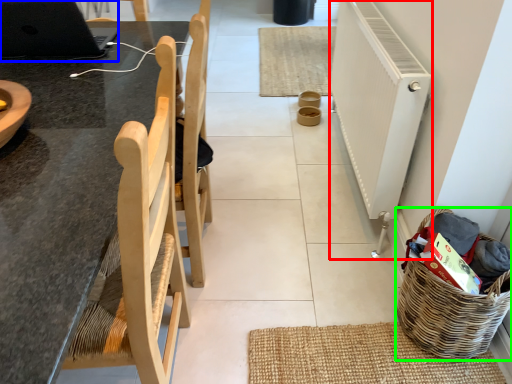
Question: Based on their relative distances, which object is farther from radiator (highlighted by a red box)? Choose from laptop (highlighted by a blue box) and basket (highlighted by a green box).

Choices:
 (A) laptop
 (B) basket

Answer: (A)